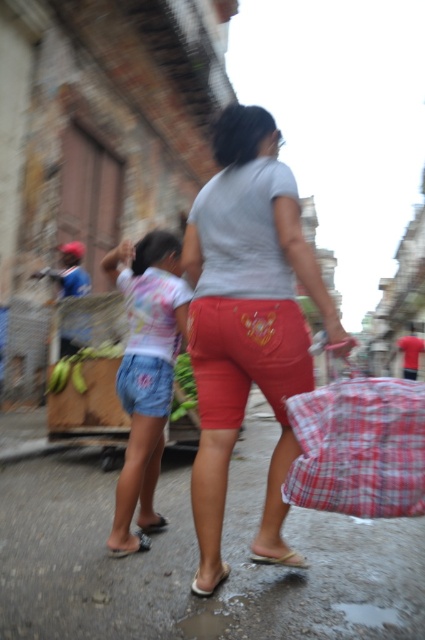
Question: Is matte gray shirt at center thinner than denim shorts at left?

Choices:
 (A) yes
 (B) no

Answer: (B)

Question: Which object is the farthest from the brown leather sandal at lower center?

Choices:
 (A) denim shorts at left
 (B) white rubber sandal at lower center
 (C) matte gray shirt at center

Answer: (A)

Question: Which point is farther to the camera?

Choices:
 (A) matte gray shirt at center
 (B) denim shorts at left

Answer: (B)

Question: Can you confirm if matte gray shirt at center is thinner than white rubber sandal at lower center?

Choices:
 (A) no
 (B) yes

Answer: (A)

Question: In this image, where is matte gray shirt at center located relative to white rubber sandal at lower center?

Choices:
 (A) left
 (B) right

Answer: (B)

Question: Which point appears farthest from the camera in this image?

Choices:
 (A) coord(146,522)
 (B) coord(212,179)

Answer: (A)